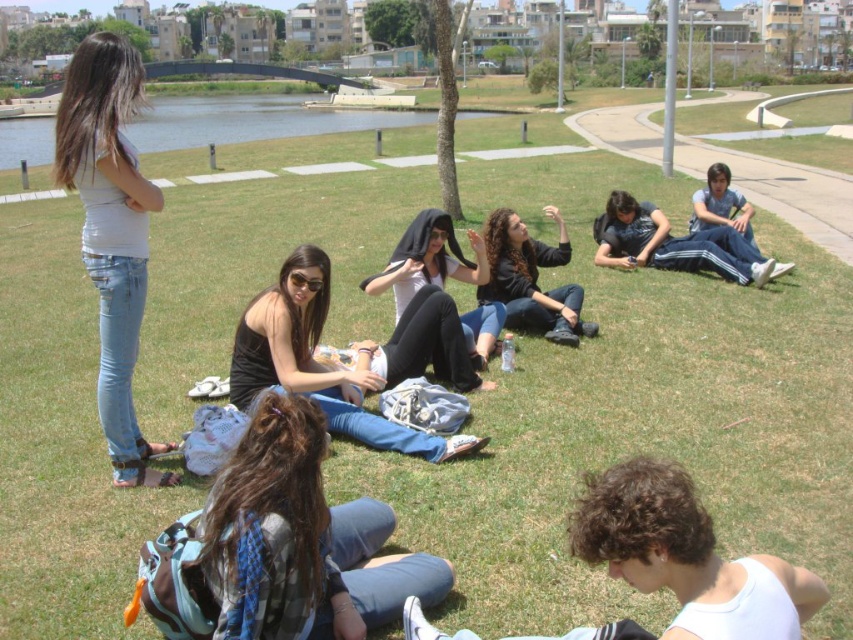
Is point (244, 337) farther from viewer compared to point (480, 285)?

No, it is not.

Measure the distance between black matte shirt at center and camera.

A distance of 6.32 meters exists between black matte shirt at center and camera.

Does point (259, 310) come closer to viewer compared to point (521, 282)?

Yes, point (259, 310) is in front of point (521, 282).

Identify the location of black matte shirt at center. Image resolution: width=853 pixels, height=640 pixels. (317, 362).

Is denim jeans at lower left below dark blue track pants at lower right?

Correct, denim jeans at lower left is located below dark blue track pants at lower right.

Is point (376, 584) positioned after point (718, 269)?

No, it is in front of (718, 269).

Where is `denim jeans at lower left`? This screenshot has width=853, height=640. denim jeans at lower left is located at coordinates (303, 538).

From the picture: Is denim jeans at lower left further to the viewer compared to black matte hoodie at center?

No, it is in front of black matte hoodie at center.

Who is taller, denim jeans at lower left or black matte hoodie at center?

denim jeans at lower left is taller.

At what (x,y) coordinates should I click in order to perform the action: click on denim jeans at lower left. Please return your answer as a coordinate pair (x, y). The width and height of the screenshot is (853, 640). Looking at the image, I should click on (303, 538).